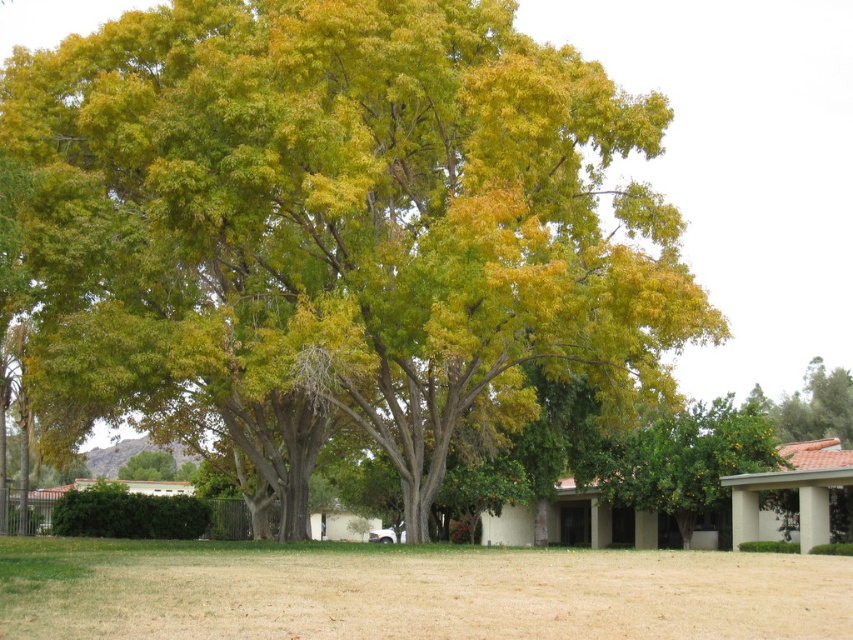
Consider the image. Does green leafy tree at center come behind brown dry grass at lower center?

Yes, green leafy tree at center is further from the viewer.

Between green leafy tree at center and brown dry grass at lower center, which one has less height?

brown dry grass at lower center

The height and width of the screenshot is (640, 853). Identify the location of green leafy tree at center. (338, 227).